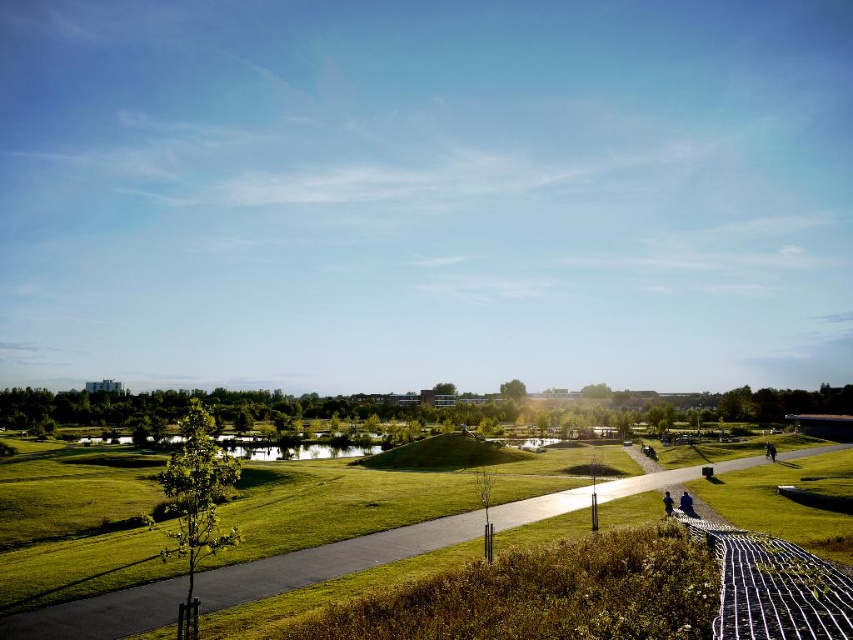
Question: Which point is closer to the camera?

Choices:
 (A) green grassy park at center
 (B) dark blue jeans at lower right
 (C) white mesh fence at lower right

Answer: (C)

Question: Considering the relative positions of green grassy park at center and white mesh fence at lower right in the image provided, where is green grassy park at center located with respect to white mesh fence at lower right?

Choices:
 (A) left
 (B) right

Answer: (B)

Question: Which point is closer to the camera?

Choices:
 (A) white mesh fence at lower right
 (B) green grassy park at center
 (C) dark blue jeans at lower right

Answer: (A)

Question: Can you confirm if green grassy park at center is smaller than white mesh fence at lower right?

Choices:
 (A) yes
 (B) no

Answer: (B)

Question: Which point is closer to the camera?

Choices:
 (A) (132, 611)
 (B) (689, 518)
 (C) (683, 502)

Answer: (A)

Question: Is green grassy park at center positioned in front of white mesh fence at lower right?

Choices:
 (A) no
 (B) yes

Answer: (A)